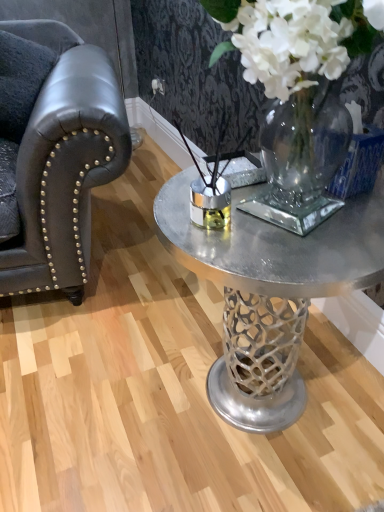
Where is `matte black leather armchair at left`? Image resolution: width=384 pixels, height=512 pixels. matte black leather armchair at left is located at coordinates (63, 164).

Where is `metallic silver coffee table at center`? metallic silver coffee table at center is located at coordinates (276, 246).

This screenshot has height=512, width=384. What are the coordinates of `dark leather armrest at left` in the screenshot? It's located at (20, 81).

Identify the location of clear glass vase at center. (297, 93).

Locate an element on the screen. This screenshot has height=512, width=384. matte black leather armchair at left is located at coordinates (63, 164).

How many degrees apart are the facing directions of clear glass vase at center and matte black leather armchair at left?

77.4 degrees.

From a real-world perspective, which object stands above the other?

clear glass vase at center is physically above.

Considering the relative positions of clear glass vase at center and matte black leather armchair at left in the image provided, is clear glass vase at center to the right of matte black leather armchair at left from the viewer's perspective?

Yes, clear glass vase at center is to the right of matte black leather armchair at left.

Is matte black leather armchair at left surrounded by clear glass vase at center?

No, matte black leather armchair at left is located outside of clear glass vase at center.

From the image's perspective, which one is positioned lower, dark leather armrest at left or matte black leather armchair at left?

matte black leather armchair at left, from the image's perspective.

Is the depth of dark leather armrest at left greater than that of matte black leather armchair at left?

That is True.

Consider the image. Can you see dark leather armrest at left touching matte black leather armchair at left?

dark leather armrest at left is not next to matte black leather armchair at left, and they're not touching.

What's the angular difference between dark leather armrest at left and matte black leather armchair at left's facing directions?

0.000413 degrees.

Would you consider dark leather armrest at left to be distant from metallic silver coffee table at center?

Actually, dark leather armrest at left and metallic silver coffee table at center are a little close together.

Is metallic silver coffee table at center a part of dark leather armrest at left?

No.

Consider the image. How many degrees apart are the facing directions of dark leather armrest at left and metallic silver coffee table at center?

The facing directions of dark leather armrest at left and metallic silver coffee table at center are 77 degrees apart.

Which of these two, dark leather armrest at left or metallic silver coffee table at center, is smaller?

Smaller between the two is metallic silver coffee table at center.

Which is in front, point (13, 130) or point (251, 22)?

The point (251, 22) is closer to the camera.

From the image's perspective, is dark leather armrest at left on clear glass vase at center?

Indeed, from the image's perspective, dark leather armrest at left is shown above clear glass vase at center.

Is clear glass vase at center at the back of dark leather armrest at left?

No.

Identify the location of dark located above the clear glass vase at center (from the image's perspective). Image resolution: width=384 pixels, height=512 pixels. (20, 81).

From the picture: From the image's perspective, does matte black leather armchair at left appear lower than clear glass vase at center?

No, from the image's perspective, matte black leather armchair at left is not beneath clear glass vase at center.

Does point (74, 188) come in front of point (283, 56)?

No, (74, 188) is behind (283, 56).

Considering the relative positions of matte black leather armchair at left and clear glass vase at center in the image provided, is matte black leather armchair at left to the left or to the right of clear glass vase at center?

From the image, it's evident that matte black leather armchair at left is to the left of clear glass vase at center.

Is matte black leather armchair at left facing towards clear glass vase at center?

No, matte black leather armchair at left is not facing towards clear glass vase at center.

From a real-world perspective, is metallic silver coffee table at center on top of dark leather armrest at left?

No.

Would you say metallic silver coffee table at center contains dark leather armrest at left?

That's incorrect, dark leather armrest at left is not inside metallic silver coffee table at center.

Considering the relative sizes of metallic silver coffee table at center and dark leather armrest at left in the image provided, is metallic silver coffee table at center thinner than dark leather armrest at left?

Yes.

Could you tell me if clear glass vase at center is turned towards metallic silver coffee table at center?

No.

Is clear glass vase at center taller than metallic silver coffee table at center?

Correct, clear glass vase at center is much taller as metallic silver coffee table at center.

Looking at this image, which object is further away from the camera, clear glass vase at center or metallic silver coffee table at center?

metallic silver coffee table at center is further away from the camera.

Is clear glass vase at center positioned beyond the bounds of metallic silver coffee table at center?

That's correct, clear glass vase at center is outside of metallic silver coffee table at center.

The height and width of the screenshot is (512, 384). There is a matte black leather armchair at left. Identify the location of floral arrangement above it (from a real-world perspective). (297, 93).

Identify the location of chair that appears on the right of dark leather armrest at left. Image resolution: width=384 pixels, height=512 pixels. (63, 164).

Based on their spatial positions, is clear glass vase at center or matte black leather armchair at left further from dark leather armrest at left?

clear glass vase at center lies further to dark leather armrest at left than the other object.

From the image, which object appears to be nearer to clear glass vase at center, metallic silver coffee table at center or dark leather armrest at left?

The object closer to clear glass vase at center is metallic silver coffee table at center.

Which object lies further to the anchor point metallic silver coffee table at center, dark leather armrest at left or matte black leather armchair at left?

Among the two, dark leather armrest at left is located further to metallic silver coffee table at center.

Based on their spatial positions, is matte black leather armchair at left or clear glass vase at center further from dark leather armrest at left?

clear glass vase at center is further to dark leather armrest at left.

Based on their spatial positions, is clear glass vase at center or metallic silver coffee table at center further from dark leather armrest at left?

clear glass vase at center is positioned further to the anchor dark leather armrest at left.

Estimate the real-world distances between objects in this image. Which object is further from metallic silver coffee table at center, dark leather armrest at left or clear glass vase at center?

dark leather armrest at left lies further to metallic silver coffee table at center than the other object.

Estimate the real-world distances between objects in this image. Which object is closer to matte black leather armchair at left, dark leather armrest at left or clear glass vase at center?

dark leather armrest at left.

Based on their spatial positions, is dark leather armrest at left or matte black leather armchair at left further from clear glass vase at center?

dark leather armrest at left lies further to clear glass vase at center than the other object.

Locate an element on the screen. This screenshot has height=512, width=384. coffee table situated between dark leather armrest at left and clear glass vase at center from left to right is located at coordinates (276, 246).

Locate an element on the screen. coffee table situated between matte black leather armchair at left and clear glass vase at center from left to right is located at coordinates (276, 246).

Image resolution: width=384 pixels, height=512 pixels. In order to click on chair between dark leather armrest at left and clear glass vase at center from left to right in this screenshot , I will do `click(63, 164)`.

This screenshot has width=384, height=512. Find the location of `chair between dark leather armrest at left and metallic silver coffee table at center in the horizontal direction`. chair between dark leather armrest at left and metallic silver coffee table at center in the horizontal direction is located at coordinates click(63, 164).